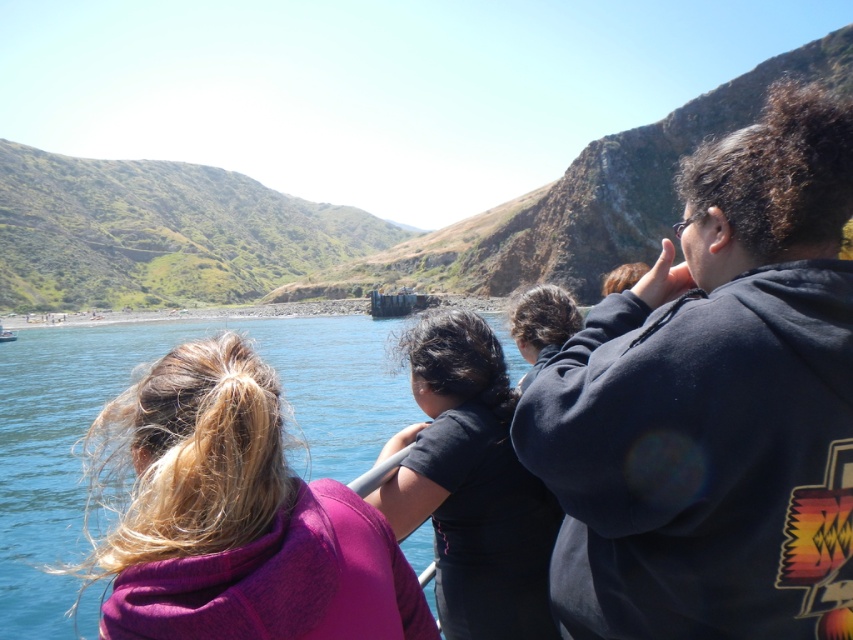
Question: Estimate the real-world distances between objects in this image. Which object is closer to the dark brown hair at center?

Choices:
 (A) purple fleece jacket at center
 (B) black matte shirt at center

Answer: (B)

Question: Which point is farther from the camera taking this photo?

Choices:
 (A) (502, 536)
 (B) (546, 422)
 (C) (151, 522)
 (D) (558, 316)

Answer: (D)

Question: Can you confirm if dark blue hoodie at upper right is bigger than dark brown hair at center?

Choices:
 (A) no
 (B) yes

Answer: (B)

Question: Does purple fleece jacket at center appear under black matte shirt at center?

Choices:
 (A) yes
 (B) no

Answer: (A)

Question: Is purple fleece jacket at center above dark brown hair at center?

Choices:
 (A) no
 (B) yes

Answer: (A)

Question: Which object is positioned closest to the dark blue hoodie at upper right?

Choices:
 (A) dark brown hair at center
 (B) purple fleece jacket at center

Answer: (A)